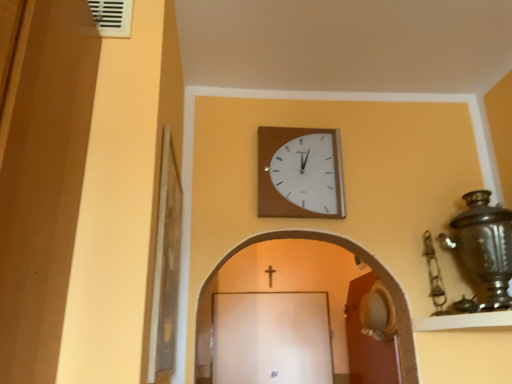
Question: Based on their positions, is brown wooden door at lower right located to the left or right of white plastic vent at upper left?

Choices:
 (A) right
 (B) left

Answer: (A)

Question: From a real-world perspective, relative to white plastic vent at upper left, is brown wooden door at lower right vertically above or below?

Choices:
 (A) below
 (B) above

Answer: (A)

Question: Estimate the real-world distances between objects in this image. Which object is closer to the wooden wall clock at upper center?

Choices:
 (A) white plastic vent at upper left
 (B) gold metallic crucifix at center
 (C) brown wooden door at lower right

Answer: (A)

Question: Which object is positioned farthest from the brown wooden door at lower right?

Choices:
 (A) wooden wall clock at upper center
 (B) gold metallic crucifix at center
 (C) white plastic vent at upper left

Answer: (C)